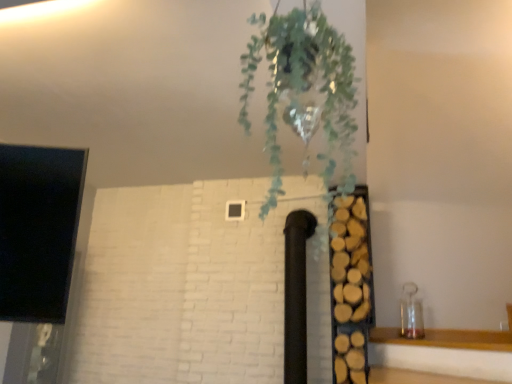
Question: Based on their sizes in the image, would you say green leafy plant at upper center is bigger or smaller than wooden logs at right?

Choices:
 (A) small
 (B) big

Answer: (A)

Question: Is green leafy plant at upper center to the left or to the right of wooden logs at right in the image?

Choices:
 (A) right
 (B) left

Answer: (B)

Question: Is point (339, 119) positioned closer to the camera than point (352, 264)?

Choices:
 (A) closer
 (B) farther

Answer: (A)

Question: Is wooden logs at right in front of or behind green leafy plant at upper center in the image?

Choices:
 (A) front
 (B) behind

Answer: (B)

Question: In terms of width, does wooden logs at right look wider or thinner when compared to green leafy plant at upper center?

Choices:
 (A) thin
 (B) wide

Answer: (B)

Question: Is point (371, 276) closer or farther from the camera than point (330, 87)?

Choices:
 (A) closer
 (B) farther

Answer: (B)

Question: Would you say wooden logs at right is inside or outside green leafy plant at upper center?

Choices:
 (A) inside
 (B) outside

Answer: (B)